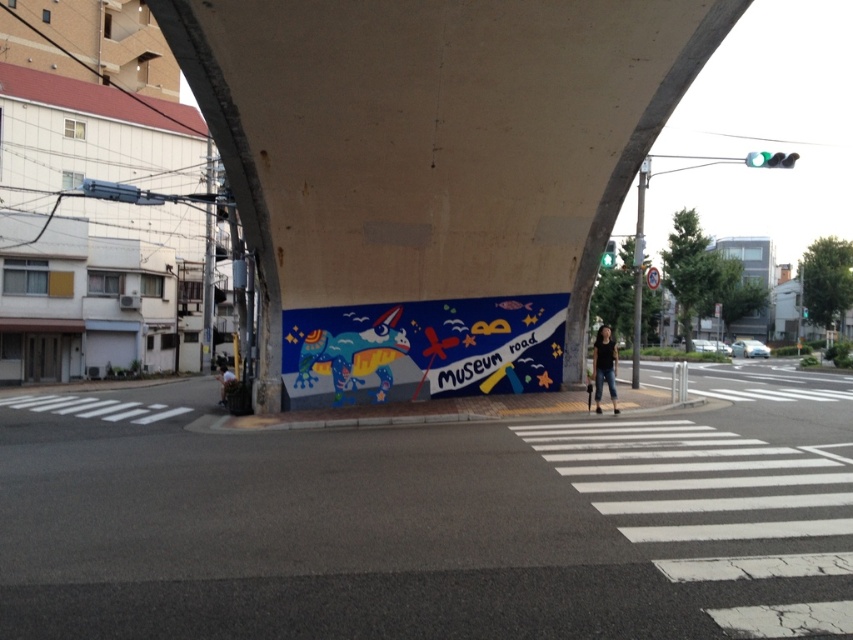
Question: Is painted mural at center smaller than colorful painted mural at center?

Choices:
 (A) yes
 (B) no

Answer: (B)

Question: Does concrete wall at center come in front of colorful painted mural at center?

Choices:
 (A) no
 (B) yes

Answer: (B)

Question: Which of the following is the closest to the observer?

Choices:
 (A) concrete wall at center
 (B) colorful painted mural at center
 (C) painted mural at center

Answer: (C)

Question: Which point is closer to the camera?

Choices:
 (A) colorful painted mural at center
 (B) concrete wall at center
 (C) painted mural at center

Answer: (C)

Question: Can you confirm if painted mural at center is smaller than concrete wall at center?

Choices:
 (A) no
 (B) yes

Answer: (B)

Question: Which point appears closest to the camera in this image?

Choices:
 (A) (657, 116)
 (B) (799, 432)

Answer: (B)